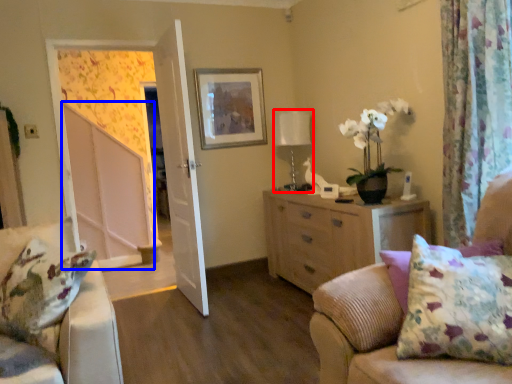
Question: Which of the following is the farthest to the observer, table lamp (highlighted by a red box) or screen door (highlighted by a blue box)?

Choices:
 (A) table lamp
 (B) screen door

Answer: (A)